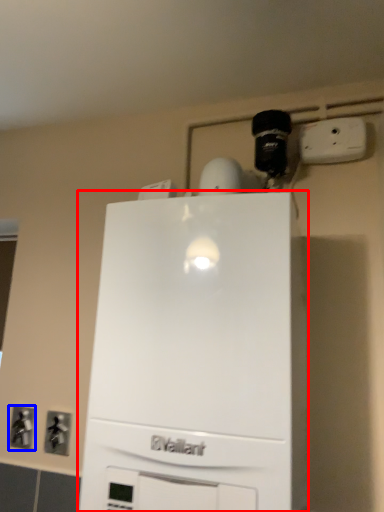
Question: Which object is further to the camera taking this photo, home appliance (highlighted by a red box) or electric outlet (highlighted by a blue box)?

Choices:
 (A) home appliance
 (B) electric outlet

Answer: (B)